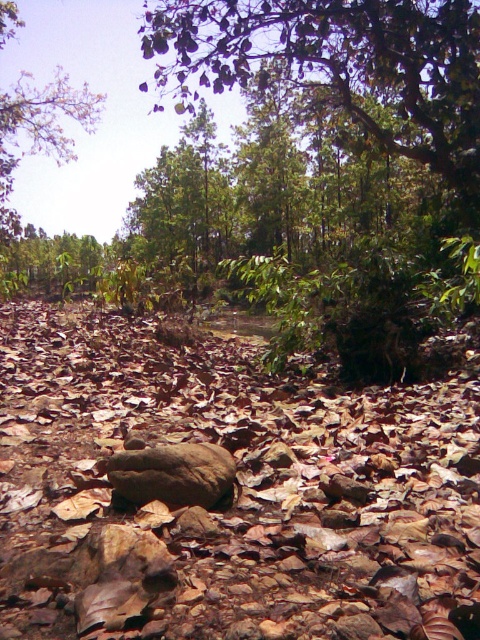
Is green leafy tree at upper left shorter than brown rough boulder at center?

Incorrect, green leafy tree at upper left's height does not fall short of brown rough boulder at center's.

From the picture: Can you confirm if green leafy tree at upper left is positioned to the right of brown rough boulder at center?

No, green leafy tree at upper left is not to the right of brown rough boulder at center.

This screenshot has width=480, height=640. What are the coordinates of `green leafy tree at upper left` in the screenshot? It's located at (36, 140).

Locate an element on the screen. The height and width of the screenshot is (640, 480). green leafy tree at upper left is located at coordinates (36, 140).

Does brown rough rock at center appear on the left side of green leafy tree at upper left?

No, brown rough rock at center is not to the left of green leafy tree at upper left.

Which of these two, brown rough rock at center or green leafy tree at upper left, stands shorter?

brown rough rock at center is shorter.

Which is in front, point (56, 502) or point (0, 188)?

Point (56, 502) is in front.

Find the location of a particular element. The width and height of the screenshot is (480, 640). brown rough rock at center is located at coordinates (228, 493).

Does brown rough rock at center appear over brown rough boulder at center?

Yes, brown rough rock at center is above brown rough boulder at center.

How distant is brown rough rock at center from brown rough boulder at center?

brown rough rock at center and brown rough boulder at center are 95.19 centimeters apart.

The width and height of the screenshot is (480, 640). Describe the element at coordinates (228, 493) in the screenshot. I see `brown rough rock at center` at that location.

Where is `brown rough rock at center`? The height and width of the screenshot is (640, 480). brown rough rock at center is located at coordinates (x=228, y=493).